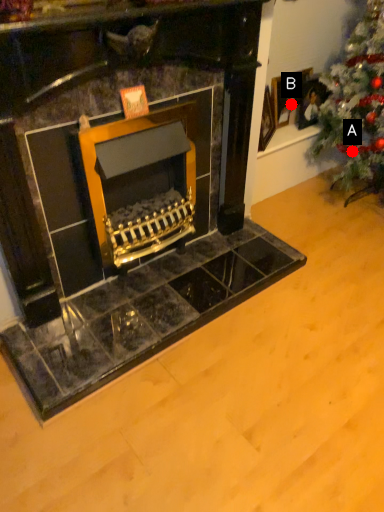
Question: Two points are circled on the image, labeled by A and B beside each circle. Among these points, which one is farthest from the camera?

Choices:
 (A) A is further
 (B) B is further

Answer: (B)